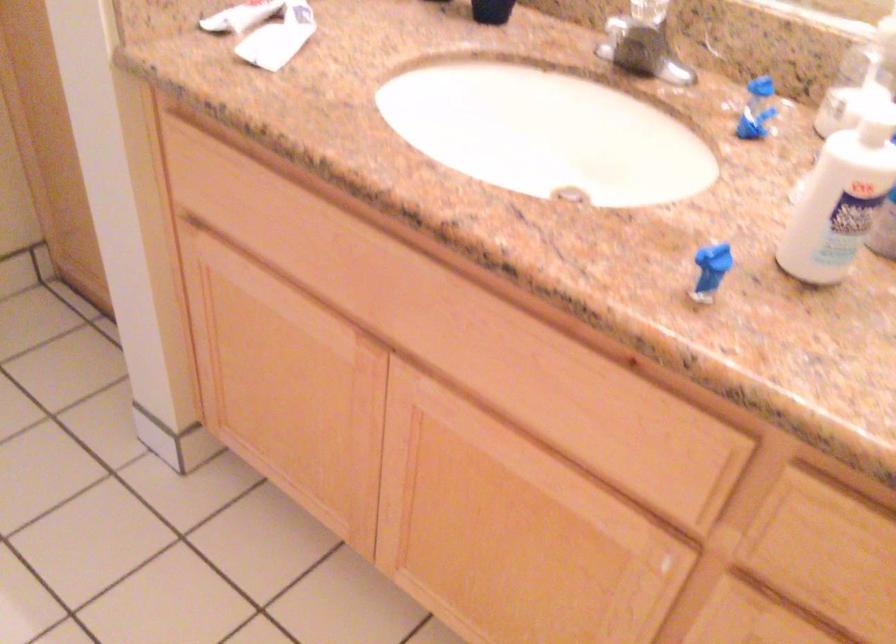
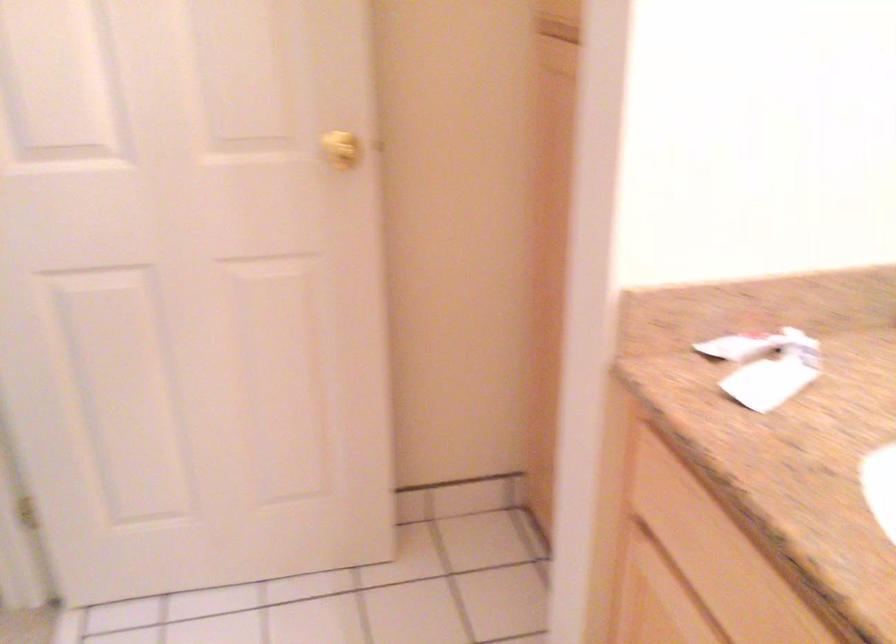
Question: The camera is either moving clockwise (left) or counter-clockwise (right) around the object. The first image is from the beginning of the video and the second image is from the end. Is the camera moving left or right when shooting the video?

Choices:
 (A) Left
 (B) Right

Answer: (B)